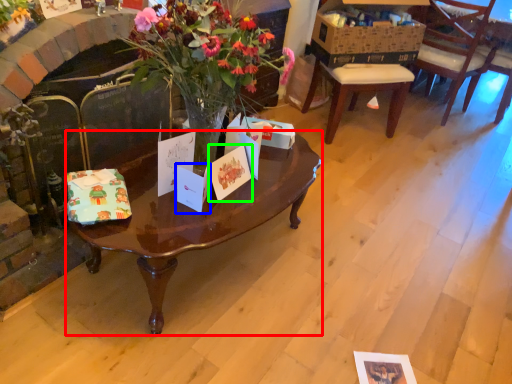
Question: Estimate the real-world distances between objects in this image. Which object is farther from coffee table (highlighted by a red box), gift card (highlighted by a blue box) or gift card (highlighted by a green box)?

Choices:
 (A) gift card
 (B) gift card

Answer: (A)